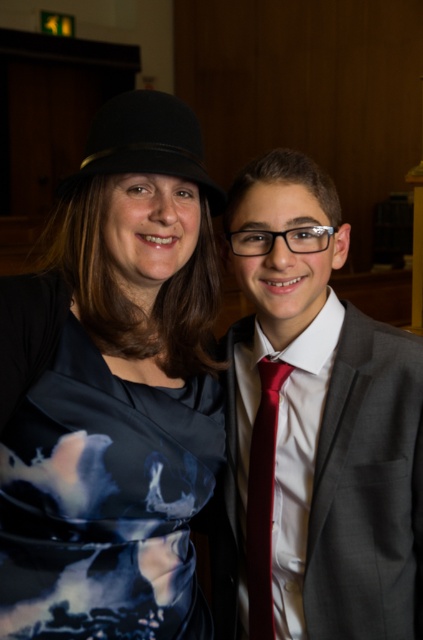
Which is below, black felt fedora at upper left or shiny red tie at center?

shiny red tie at center is below.

Who is more distant from viewer, (x=167, y=113) or (x=250, y=609)?

Point (x=250, y=609)

Who is more distant from viewer, (200, 180) or (264, 582)?

The point (264, 582) is behind.

Where is `black felt fedora at upper left`? black felt fedora at upper left is located at coordinates (147, 141).

Does matte gray suit at right appear on the left side of black felt fedora at upper left?

In fact, matte gray suit at right is to the right of black felt fedora at upper left.

Does matte gray suit at right appear on the right side of black felt fedora at upper left?

Yes, matte gray suit at right is to the right of black felt fedora at upper left.

Image resolution: width=423 pixels, height=640 pixels. Identify the location of matte gray suit at right. (315, 435).

I want to click on matte gray suit at right, so 315,435.

Which is more to the left, matte gray suit at right or dark blue satin dress at center?

From the viewer's perspective, dark blue satin dress at center appears more on the left side.

The width and height of the screenshot is (423, 640). What do you see at coordinates (315, 435) in the screenshot?
I see `matte gray suit at right` at bounding box center [315, 435].

Locate an element on the screen. The width and height of the screenshot is (423, 640). matte gray suit at right is located at coordinates (315, 435).